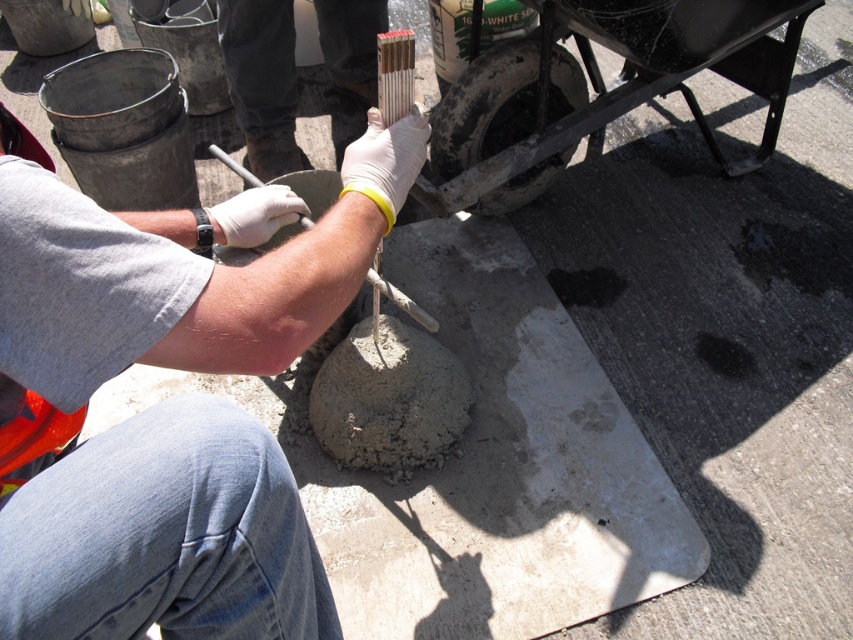
You are a construction worker who needs to reach for a tool. You see the white matte gloves at center and the white rubber shovel at center. Which one is closer to you?

The white matte gloves at center are closer to the viewer than the white rubber shovel at center.

Looking at this image, you are a construction worker who needs to reach the white matte gloves at center from your current position. The camera is mounted on a crane operator seat. Can you safely stretch your arm to grab them without moving your body?

The white matte gloves at center are 25.63 inches away from the camera. Since the average human arm length is about 25 inches, you might be able to just reach them if you stretch your arm fully, but it would require maximum extension and might be slightly uncomfortable. It is technically possible but not very comfortable.

What are the coordinates of the white matte gloves at center?

The white matte gloves at center are located at coordinates point (167, 401).